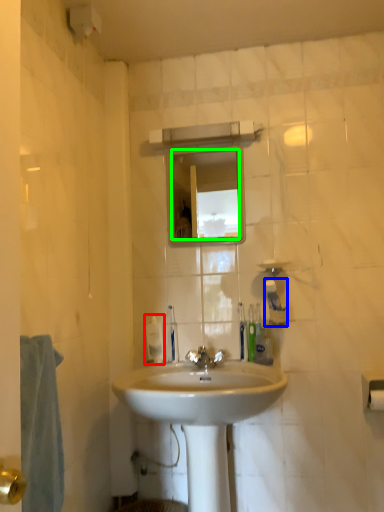
Question: Considering the real-world distances, which object is closest to soap dispenser (highlighted by a red box)? toiletry (highlighted by a blue box) or mirror (highlighted by a green box).

Choices:
 (A) toiletry
 (B) mirror

Answer: (A)